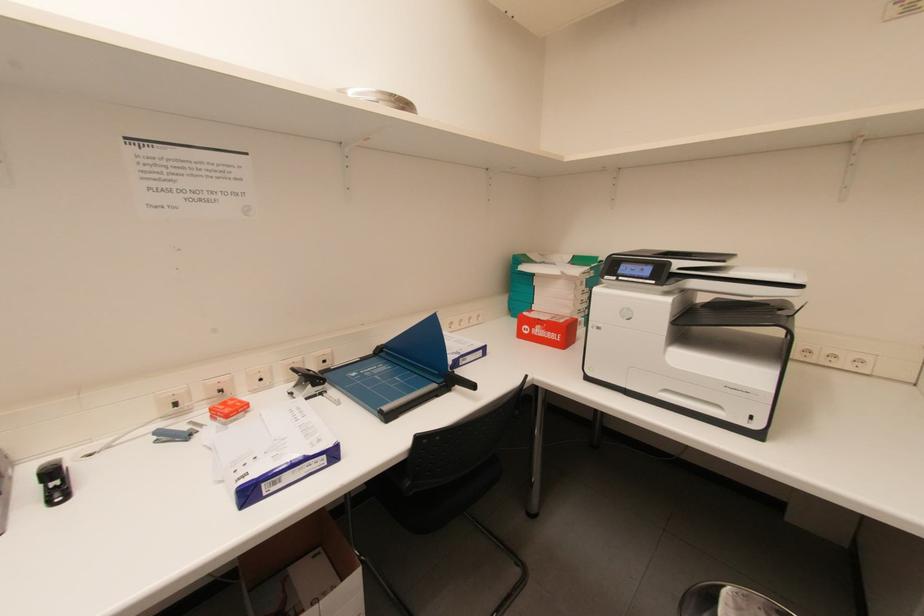
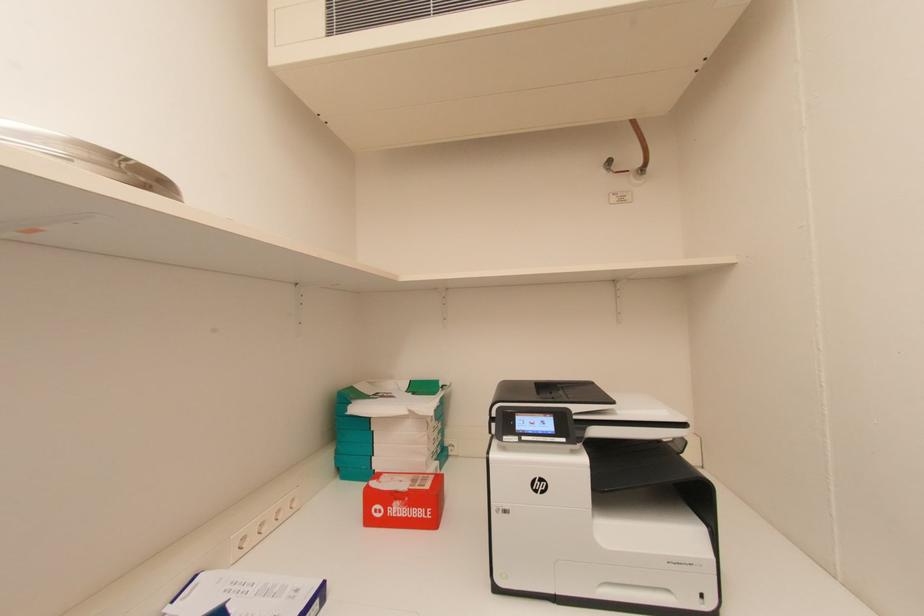
Question: The camera is either moving clockwise (left) or counter-clockwise (right) around the object. The first image is from the beginning of the video and the second image is from the end. Is the camera moving left or right when shooting the video?

Choices:
 (A) Left
 (B) Right

Answer: (A)